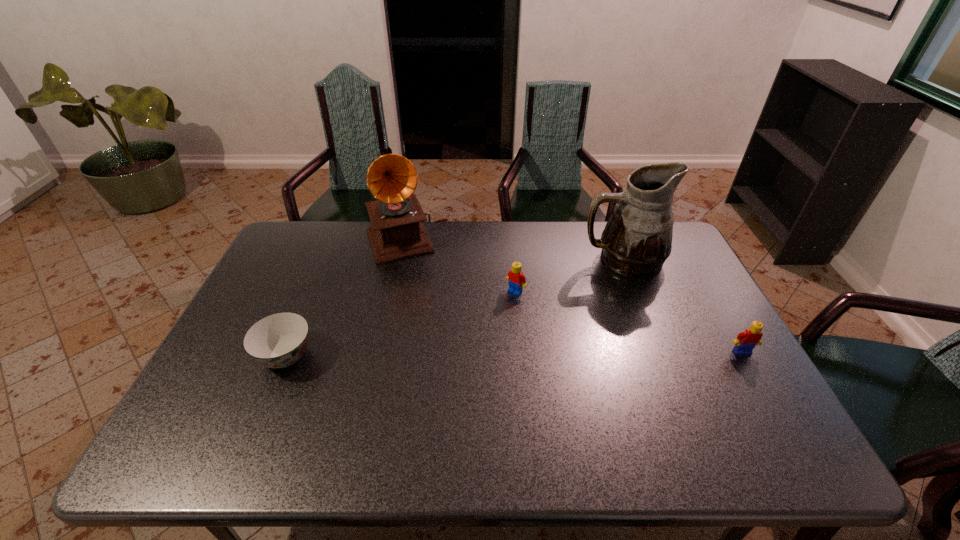
Where is `vacant position located 0.060m on the horn of the phonograph record`? The height and width of the screenshot is (540, 960). vacant position located 0.060m on the horn of the phonograph record is located at coordinates (420, 275).

You are a GUI agent. You are given a task and a screenshot of the screen. Output one action in this format:
    pyautogui.click(x=<x>, y=<y>)
    Task: Click on the free spot located on the horn of the phonograph record
    The image size is (960, 540).
    Given the screenshot: What is the action you would take?
    pyautogui.click(x=435, y=312)

Where is `vacant space situated 0.050m on the horn of the phonograph record`? vacant space situated 0.050m on the horn of the phonograph record is located at coordinates (420, 273).

Identify the location of vacant region located from the spout of the fourth object from left to right. The width and height of the screenshot is (960, 540). (572, 287).

I want to click on free space located 0.090m from the spout of the fourth object from left to right, so click(574, 286).

Where is `vacant area situated from the spout of the fourth object from left to right`? This screenshot has width=960, height=540. vacant area situated from the spout of the fourth object from left to right is located at coordinates (574, 286).

Identify the location of vacant space situated on the face of the farther Lego. The image size is (960, 540). (449, 359).

Find the location of a particular element. free space located on the face of the farther Lego is located at coordinates (480, 326).

Where is `free space located 0.330m on the face of the farther Lego`? This screenshot has height=540, width=960. free space located 0.330m on the face of the farther Lego is located at coordinates (439, 369).

Image resolution: width=960 pixels, height=540 pixels. In order to click on phonograph record that is at the far edge in this screenshot , I will do `click(397, 232)`.